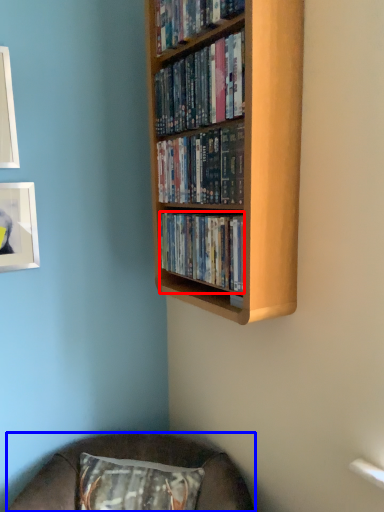
Question: Among these objects, which one is nearest to the camera, book (highlighted by a red box) or furniture (highlighted by a blue box)?

Choices:
 (A) book
 (B) furniture

Answer: (A)